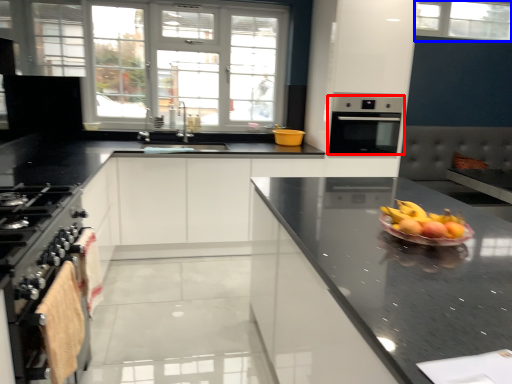
Question: Which object is closer to the camera taking this photo, oven (highlighted by a red box) or window (highlighted by a blue box)?

Choices:
 (A) oven
 (B) window

Answer: (A)